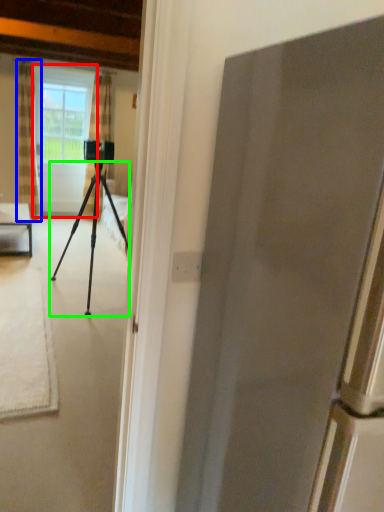
Question: Which is farther away from screen door (highlighted by a red box)? curtain (highlighted by a blue box) or tripod (highlighted by a green box)?

Choices:
 (A) curtain
 (B) tripod

Answer: (B)